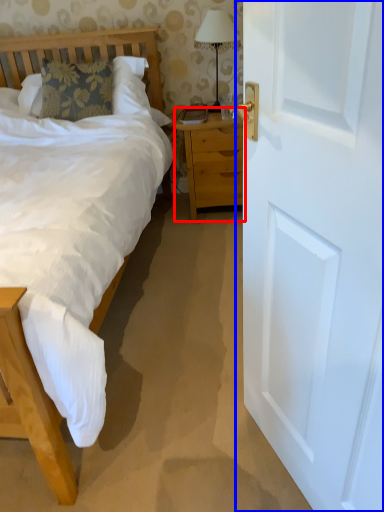
Question: Which point is further to the camera, nightstand (highlighted by a red box) or door (highlighted by a blue box)?

Choices:
 (A) nightstand
 (B) door

Answer: (A)